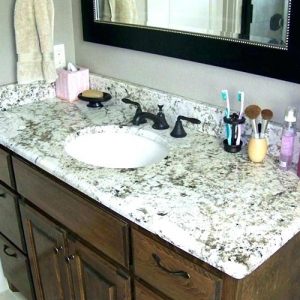
Find the location of a particular element. The height and width of the screenshot is (300, 300). makeup brush is located at coordinates (251, 112), (266, 115), (257, 128).